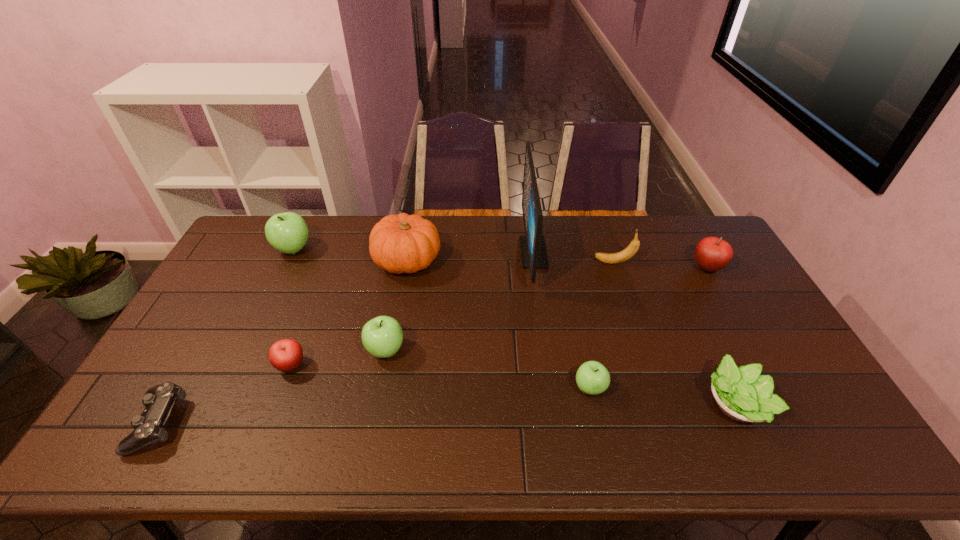
Locate an element on the screen. The width and height of the screenshot is (960, 540). vacant point that satisfies the following two spatial constraints: 1. on the screen side of the black computer monitor; 2. on the right side of the green lettuce is located at coordinates (554, 404).